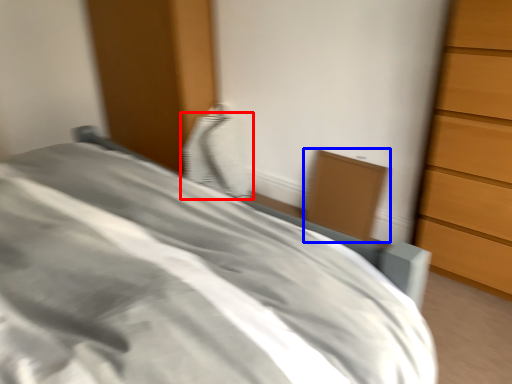
Question: Which object appears farthest to the camera in this image, pillow (highlighted by a red box) or cabinetry (highlighted by a blue box)?

Choices:
 (A) pillow
 (B) cabinetry

Answer: (A)